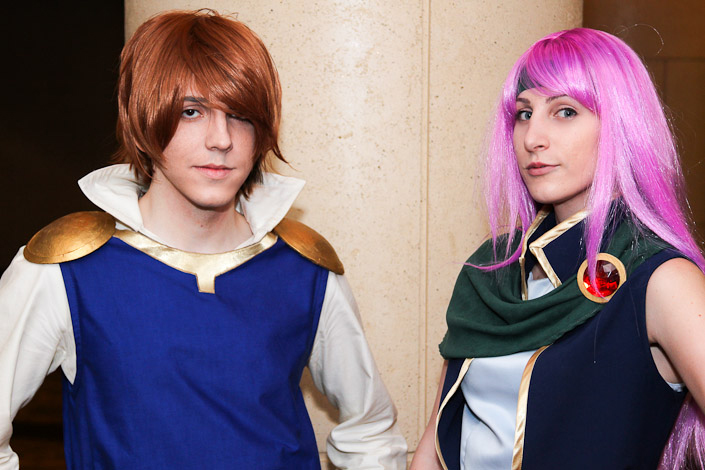
Find the location of a particular element. The image size is (705, 470). wall is located at coordinates (379, 99).